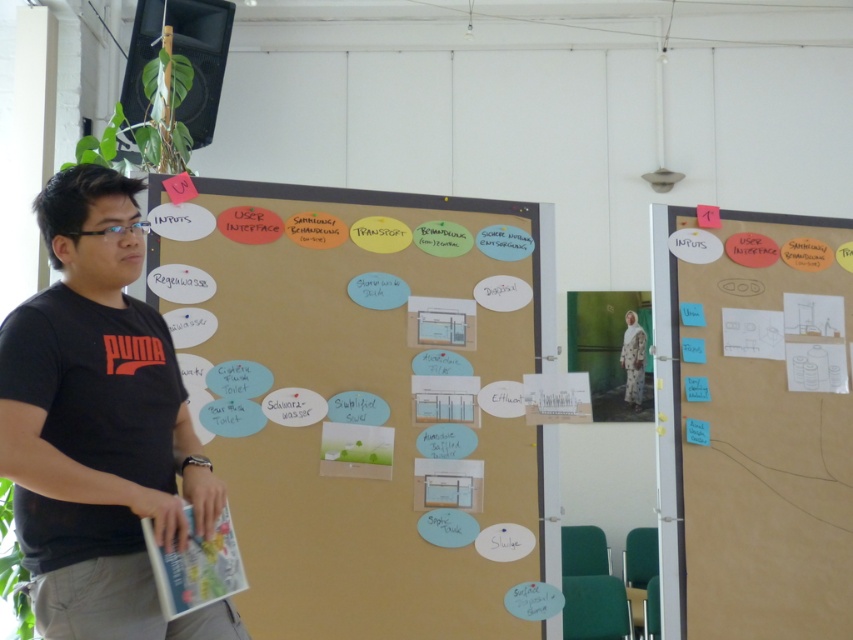
Question: Among these objects, which one is farthest from the camera?

Choices:
 (A) black cotton t-shirt at left
 (B) white paperboard at right

Answer: (B)

Question: Is brown paperboard at center below black cotton t-shirt at left?

Choices:
 (A) yes
 (B) no

Answer: (B)

Question: Is brown paperboard at center smaller than white paperboard at right?

Choices:
 (A) yes
 (B) no

Answer: (B)

Question: Estimate the real-world distances between objects in this image. Which object is farther from the white paperboard at right?

Choices:
 (A) black cotton t-shirt at left
 (B) brown paperboard at center

Answer: (A)

Question: Which point is farther to the camera?

Choices:
 (A) brown paperboard at center
 (B) black cotton t-shirt at left

Answer: (A)

Question: Does brown paperboard at center come behind white paperboard at right?

Choices:
 (A) yes
 (B) no

Answer: (B)